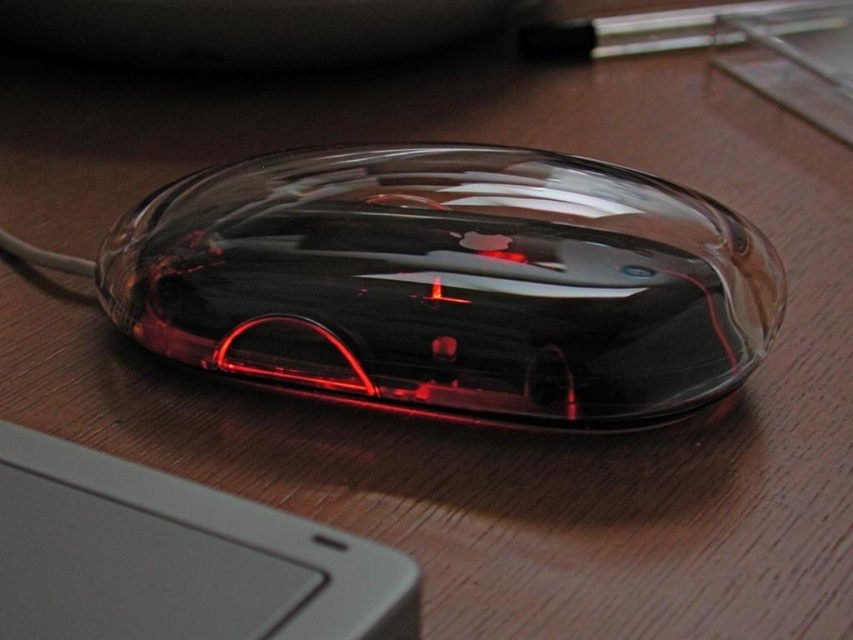
Who is taller, transparent plastic mouse at center or gray matte keyboard at lower left?

With more height is transparent plastic mouse at center.

Is transparent plastic mouse at center smaller than gray matte keyboard at lower left?

No, transparent plastic mouse at center is not smaller than gray matte keyboard at lower left.

Describe the element at coordinates (451, 282) in the screenshot. I see `transparent plastic mouse at center` at that location.

The width and height of the screenshot is (853, 640). What are the coordinates of `transparent plastic mouse at center` in the screenshot? It's located at (451, 282).